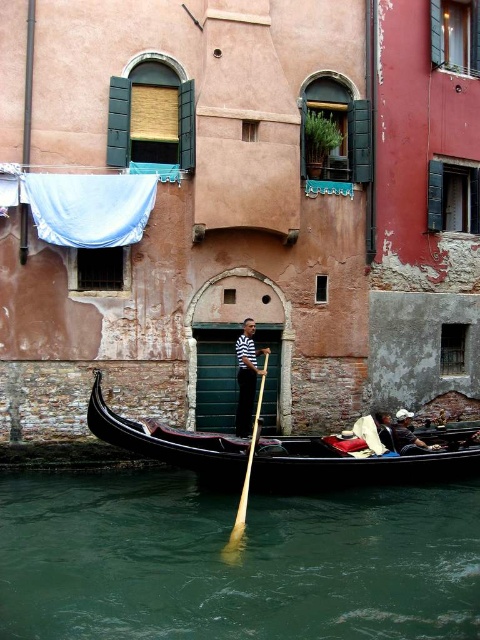
Is wooden polished paddle at center further to the viewer compared to dark blue fabric at lower right?

That is False.

Is wooden polished paddle at center below dark blue fabric at lower right?

Yes.

Which is behind, point (260, 397) or point (392, 442)?

The point (260, 397) is more distant.

Image resolution: width=480 pixels, height=640 pixels. In order to click on wooden polished paddle at center in this screenshot , I will do `click(245, 481)`.

Is wooden polished paddle at center wider than leather jacket at lower right?

No.

Does wooden polished paddle at center have a greater height compared to leather jacket at lower right?

No, wooden polished paddle at center is not taller than leather jacket at lower right.

Describe the element at coordinates (245, 481) in the screenshot. I see `wooden polished paddle at center` at that location.

This screenshot has width=480, height=640. I want to click on wooden polished paddle at center, so click(x=245, y=481).

Is point (95, 605) behind point (386, 440)?

No.

Where is `green liquid water at lower center`? Image resolution: width=480 pixels, height=640 pixels. green liquid water at lower center is located at coordinates (235, 563).